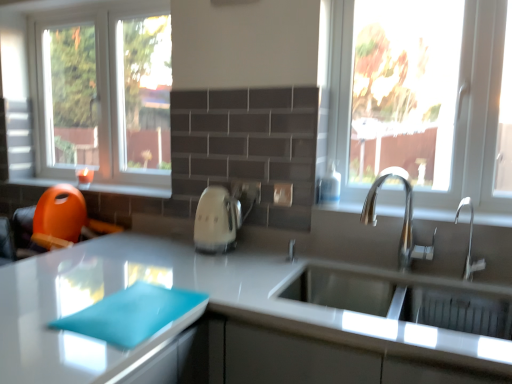
Question: Can you confirm if satin nickel faucet at sink right, positioned as the first tap in right-to-left order, is thinner than white glossy electric kettle at center?

Choices:
 (A) no
 (B) yes

Answer: (B)

Question: Is white glossy electric kettle at center at the back of satin nickel faucet at sink right, positioned as the second tap in left-to-right order?

Choices:
 (A) no
 (B) yes

Answer: (A)

Question: Is satin nickel faucet at sink right, positioned as the second tap in left-to-right order, wider than white glossy electric kettle at center?

Choices:
 (A) yes
 (B) no

Answer: (B)

Question: Is satin nickel faucet at sink right, positioned as the second tap in left-to-right order, placed right next to white glossy electric kettle at center?

Choices:
 (A) yes
 (B) no

Answer: (B)

Question: Considering the relative sizes of satin nickel faucet at sink right, positioned as the first tap in right-to-left order, and white glossy electric kettle at center in the image provided, is satin nickel faucet at sink right, positioned as the first tap in right-to-left order, taller than white glossy electric kettle at center?

Choices:
 (A) yes
 (B) no

Answer: (B)

Question: Does satin nickel faucet at sink right, positioned as the second tap in left-to-right order, have a larger size compared to white glossy electric kettle at center?

Choices:
 (A) yes
 (B) no

Answer: (B)

Question: Does white glossy electric kettle at center have a smaller size compared to metallic silver sink at right, placed as the 2th window sill when sorted from top to bottom?

Choices:
 (A) yes
 (B) no

Answer: (B)

Question: Can you confirm if white glossy electric kettle at center is shorter than metallic silver sink at right, arranged as the first window sill when viewed from the right?

Choices:
 (A) yes
 (B) no

Answer: (B)

Question: From the image's perspective, does white glossy electric kettle at center appear higher than metallic silver sink at right, arranged as the 2th window sill when viewed from the back?

Choices:
 (A) no
 (B) yes

Answer: (A)

Question: Are white glossy electric kettle at center and metallic silver sink at right, arranged as the 1th window sill when viewed from the front, beside each other?

Choices:
 (A) no
 (B) yes

Answer: (A)

Question: Does white glossy electric kettle at center appear on the left side of metallic silver sink at right, arranged as the 1th window sill when viewed from the front?

Choices:
 (A) yes
 (B) no

Answer: (A)

Question: Considering the relative sizes of white glossy electric kettle at center and metallic silver sink at right, placed as the 2th window sill when sorted from top to bottom, in the image provided, is white glossy electric kettle at center bigger than metallic silver sink at right, placed as the 2th window sill when sorted from top to bottom,?

Choices:
 (A) yes
 (B) no

Answer: (A)

Question: Considering the relative sizes of metallic silver sink at right, marked as the 1th window sill in a bottom-to-top arrangement, and clear glass window at left, arranged as the 1th window when viewed from the back, in the image provided, is metallic silver sink at right, marked as the 1th window sill in a bottom-to-top arrangement, taller than clear glass window at left, arranged as the 1th window when viewed from the back,?

Choices:
 (A) no
 (B) yes

Answer: (A)